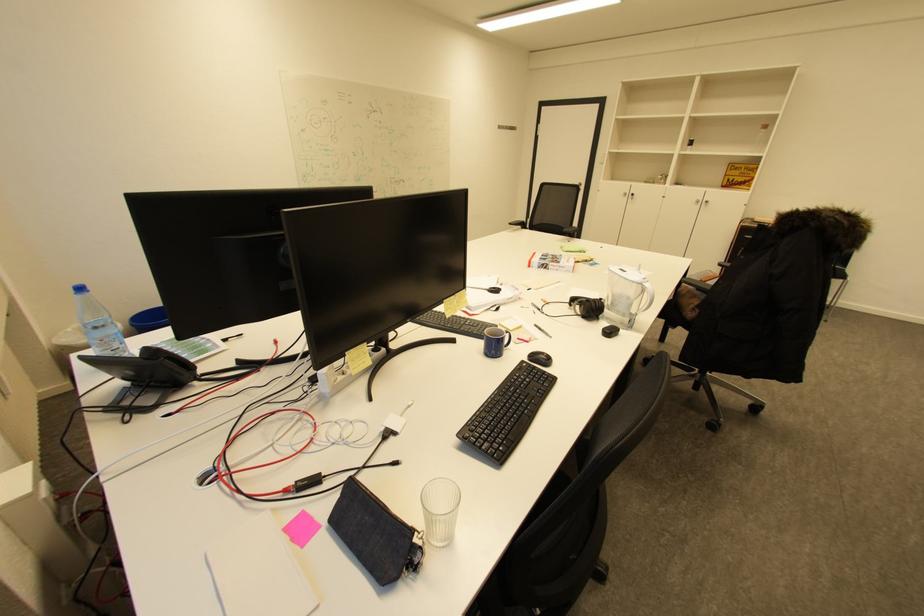
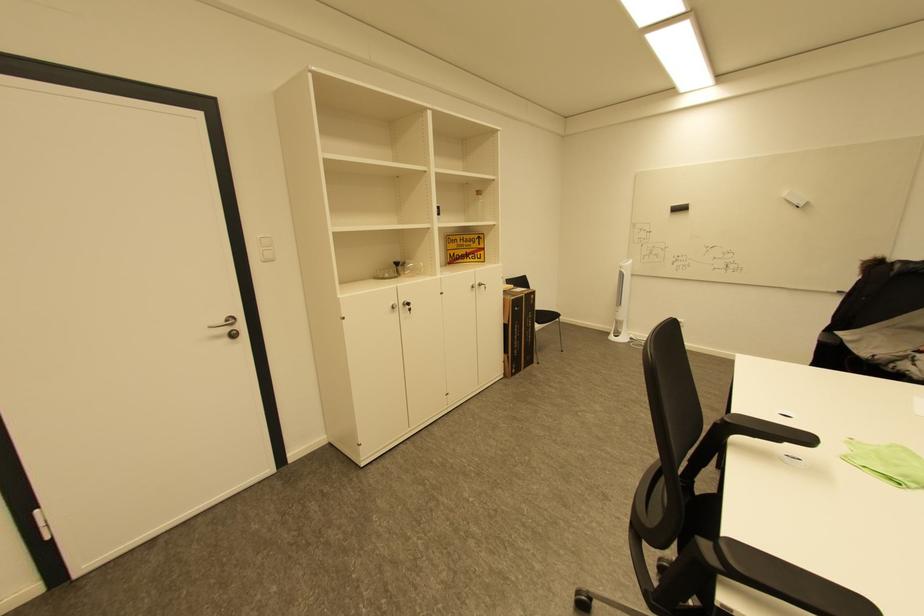
Where in the second image is the point corresponding to point (630, 195) from the first image?

(398, 308)